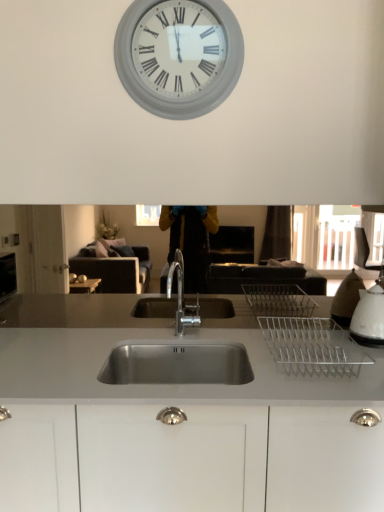
Question: Should I look upward or downward to see stainless steel sink at center?

Choices:
 (A) down
 (B) up

Answer: (A)

Question: From the image's perspective, is stainless steel sink at center below white glossy kettle at right?

Choices:
 (A) yes
 (B) no

Answer: (A)

Question: From a real-world perspective, is stainless steel sink at center physically below white glossy kettle at right?

Choices:
 (A) yes
 (B) no

Answer: (A)

Question: Does stainless steel sink at center come behind white glossy kettle at right?

Choices:
 (A) no
 (B) yes

Answer: (A)

Question: Is stainless steel sink at center closer to the viewer compared to white glossy kettle at right?

Choices:
 (A) no
 (B) yes

Answer: (B)

Question: From the image's perspective, is stainless steel sink at center over white glossy kettle at right?

Choices:
 (A) no
 (B) yes

Answer: (A)

Question: Is stainless steel sink at center surrounding white glossy kettle at right?

Choices:
 (A) no
 (B) yes

Answer: (A)

Question: Is white matte clock at upper center touching stainless steel sink at center?

Choices:
 (A) no
 (B) yes

Answer: (A)

Question: Is white matte clock at upper center not close to stainless steel sink at center?

Choices:
 (A) no
 (B) yes

Answer: (B)

Question: Does white matte clock at upper center have a larger size compared to stainless steel sink at center?

Choices:
 (A) no
 (B) yes

Answer: (A)

Question: Can you confirm if white matte clock at upper center is taller than stainless steel sink at center?

Choices:
 (A) no
 (B) yes

Answer: (A)

Question: Is white matte clock at upper center oriented towards stainless steel sink at center?

Choices:
 (A) yes
 (B) no

Answer: (B)

Question: Considering the relative sizes of white matte clock at upper center and stainless steel sink at center in the image provided, is white matte clock at upper center shorter than stainless steel sink at center?

Choices:
 (A) yes
 (B) no

Answer: (A)

Question: From the image's perspective, is white matte clock at upper center on top of white glossy kettle at right?

Choices:
 (A) no
 (B) yes

Answer: (B)